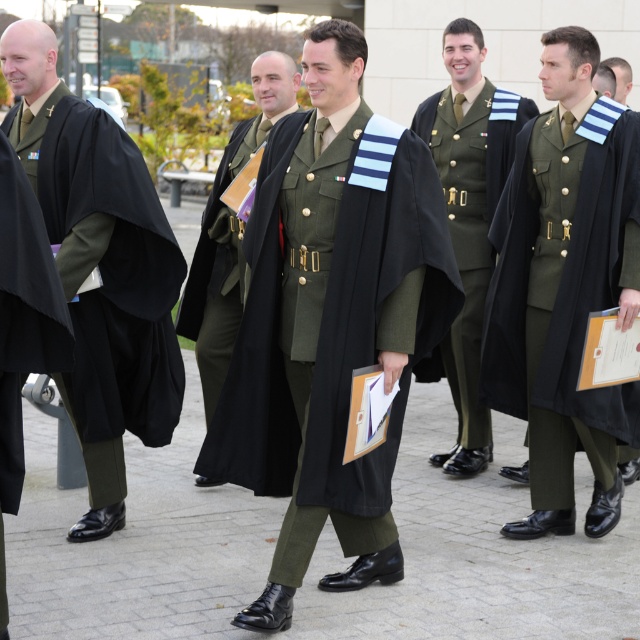
Question: Which point is closer to the camera?

Choices:
 (A) (193, 260)
 (B) (621, 86)
 (C) (42, 237)

Answer: (C)

Question: Which point is closer to the camera taking this photo?

Choices:
 (A) (536, 412)
 (B) (124, 173)
 (C) (13, 349)

Answer: (C)

Question: Among these points, which one is farthest from the camera?

Choices:
 (A) (620, 58)
 (B) (109, 259)

Answer: (A)

Question: Does matte black robe at center appear on the left side of matte black coat at center?

Choices:
 (A) yes
 (B) no

Answer: (B)

Question: Does green military uniform at center lie in front of matte black hair at upper right?

Choices:
 (A) yes
 (B) no

Answer: (A)

Question: Is matte black robe at center positioned before matte black hair at upper right?

Choices:
 (A) no
 (B) yes

Answer: (B)